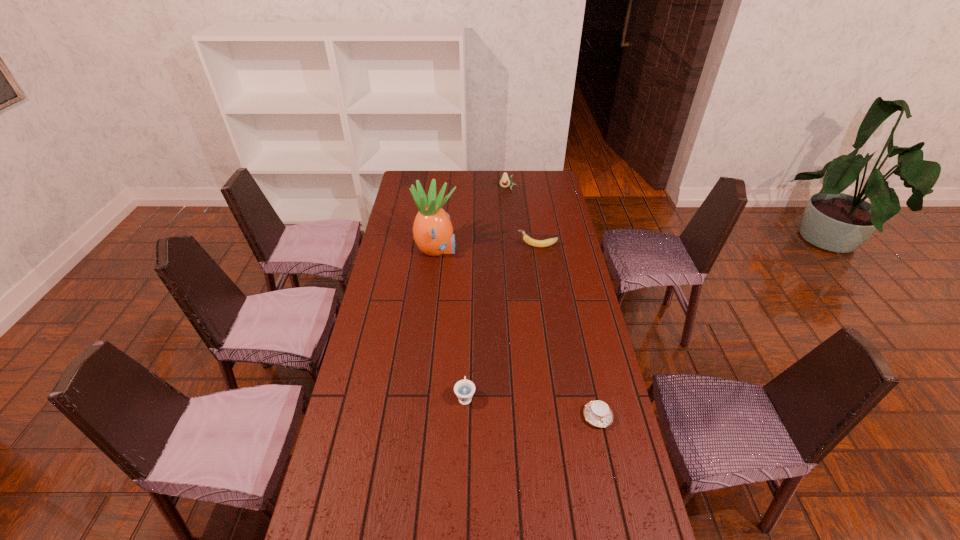
The height and width of the screenshot is (540, 960). In order to click on teacup that is positioned at the right edge in this screenshot , I will do `click(597, 413)`.

In the image, there is a desktop. Find the location of `vacant space at the far edge`. vacant space at the far edge is located at coordinates (507, 193).

Identify the location of vacant space at the left edge of the desktop. This screenshot has height=540, width=960. (408, 327).

The width and height of the screenshot is (960, 540). I want to click on free location at the right edge of the desktop, so click(x=574, y=352).

Find the location of a particular element. The image size is (960, 540). vacant area at the far left corner is located at coordinates 413,178.

At what (x,y) coordinates should I click in order to perform the action: click on blank region between the pineapple and the banana. Please return your answer as a coordinate pair (x, y). The width and height of the screenshot is (960, 540). Looking at the image, I should click on (487, 248).

Identify the location of free space between the left teacup and the shortest object. Image resolution: width=960 pixels, height=540 pixels. (531, 407).

Where is `empty space between the farthest object and the shortest object`? empty space between the farthest object and the shortest object is located at coordinates (553, 302).

The image size is (960, 540). I want to click on free space that is in between the fourth tallest object and the farthest object, so click(487, 292).

You are a GUI agent. You are given a task and a screenshot of the screen. Output one action in this format:
    pyautogui.click(x=<x>, y=<y>)
    Task: Click on the vacant area that lies between the right teacup and the leftmost object
    
    Given the screenshot: What is the action you would take?
    pyautogui.click(x=517, y=333)